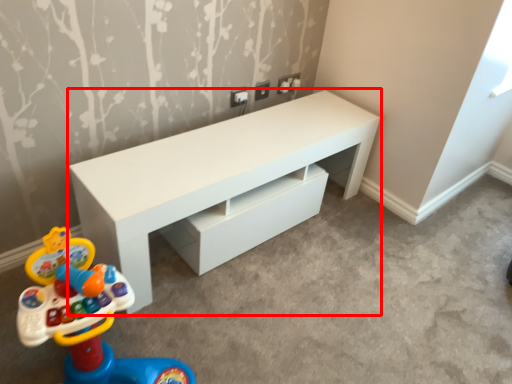
Question: From the image's perspective, what is the correct spatial positioning of table (annotated by the red box) in reference to toy?

Choices:
 (A) above
 (B) below

Answer: (A)